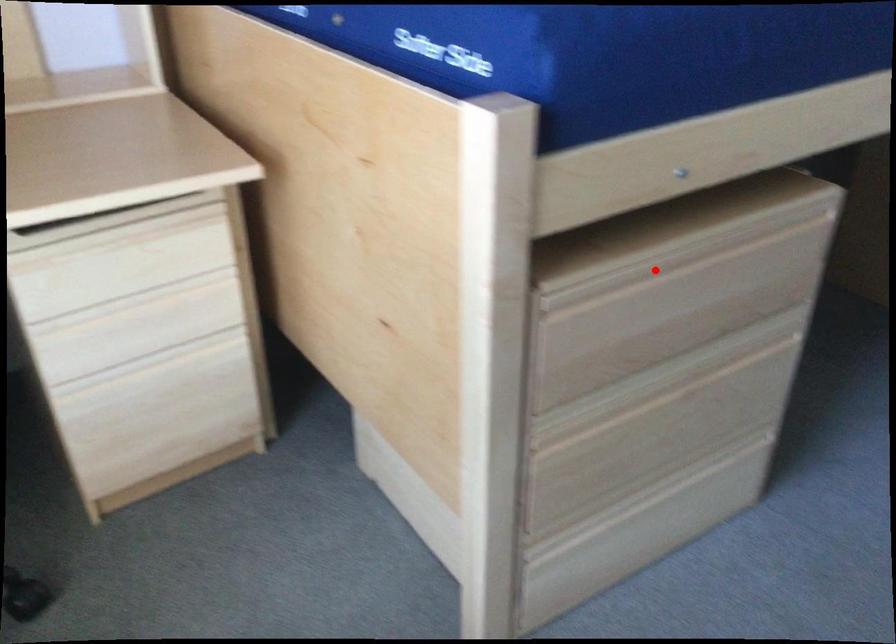
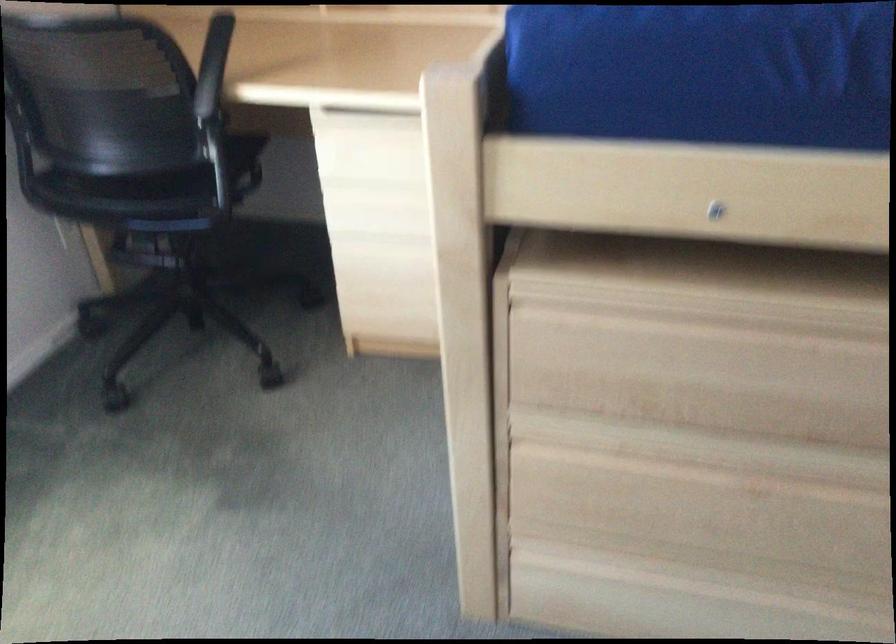
Question: I am providing you with two images of the same scene from different viewpoints. In image1, a red point is highlighted. Considering the same 3D point in image2, which of the following is correct?

Choices:
 (A) It is closer
 (B) It is farther

Answer: (A)